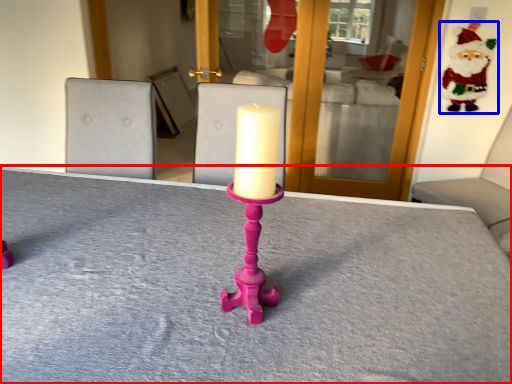
Question: Which of the following is the closest to the observer, table (highlighted by a red box) or santa claus (highlighted by a blue box)?

Choices:
 (A) table
 (B) santa claus

Answer: (A)